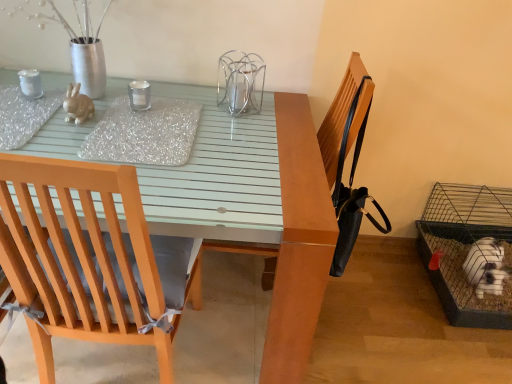
Where is `empty space that is to the right of clear glass candle holder at center, the 2th bird cage ordered from the bottom`? This screenshot has width=512, height=384. empty space that is to the right of clear glass candle holder at center, the 2th bird cage ordered from the bottom is located at coordinates (291, 114).